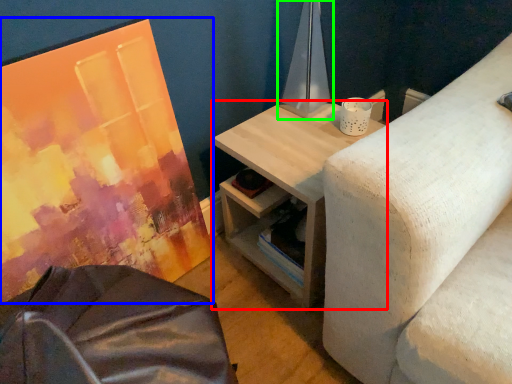
Question: Which is nearer to the table (highlighted by a red box)? canvas (highlighted by a blue box) or table lamp (highlighted by a green box).

Choices:
 (A) canvas
 (B) table lamp

Answer: (B)